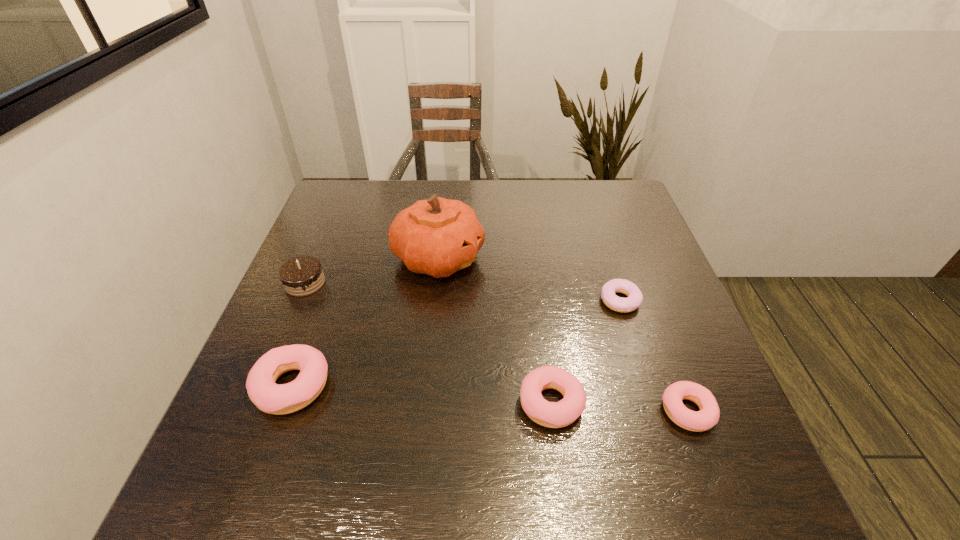
Identify the location of the leftmost doughnut. The width and height of the screenshot is (960, 540). (269, 397).

Where is `the tallest doughnut`? The width and height of the screenshot is (960, 540). the tallest doughnut is located at coordinates 269,397.

This screenshot has height=540, width=960. Find the location of `the third doughnut from right to left`. the third doughnut from right to left is located at coordinates (559, 414).

You are a GUI agent. You are given a task and a screenshot of the screen. Output one action in this format:
    pyautogui.click(x=<x>, y=<y>)
    Task: Click on the fourth object from left to right
    
    Given the screenshot: What is the action you would take?
    pyautogui.click(x=559, y=414)

At what (x,y) coordinates should I click in order to perform the action: click on the farthest doughnut. Please return your answer as a coordinate pair (x, y). This screenshot has height=540, width=960. Looking at the image, I should click on (619, 304).

Locate an element on the screen. the fifth shortest object is located at coordinates (301, 276).

Where is `pumpkin`? This screenshot has height=540, width=960. pumpkin is located at coordinates (438, 236).

Locate an element on the screen. the tallest object is located at coordinates (438, 236).

Identify the location of vacant space located on the back of the leftmost doughnut. The image size is (960, 540). (327, 288).

Locate an element on the screen. vacant space situated on the back of the third doughnut from right to left is located at coordinates (534, 273).